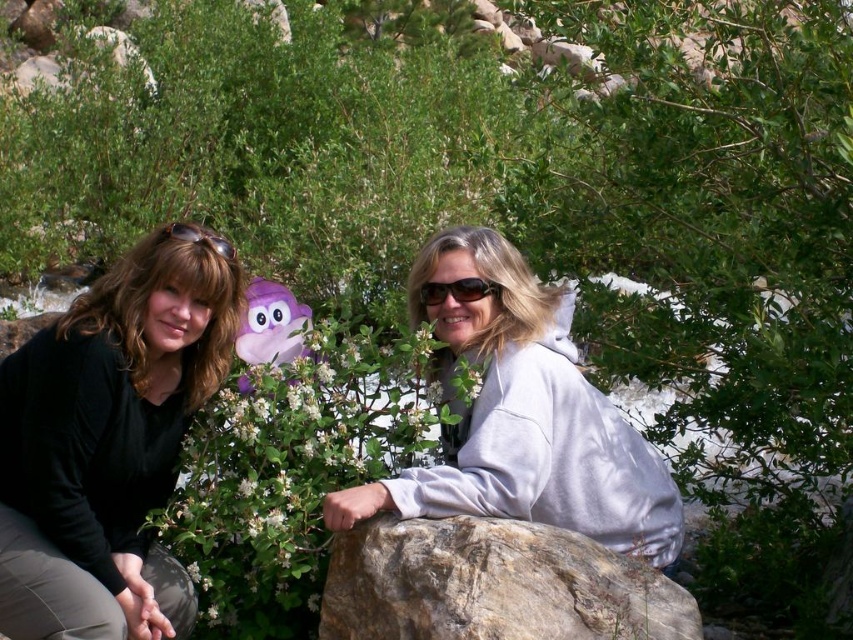
Question: Is white fleece jacket at center positioned behind rocky gray boulder at center?

Choices:
 (A) yes
 (B) no

Answer: (A)

Question: Considering the real-world distances, which object is farthest from the matte black sunglasses at upper left?

Choices:
 (A) rocky gray boulder at center
 (B) black matte shirt at lower left

Answer: (A)

Question: Is black matte shirt at lower left positioned at the back of white fleece jacket at center?

Choices:
 (A) yes
 (B) no

Answer: (B)

Question: Is black matte shirt at lower left closer to the viewer compared to matte black sunglasses at upper left?

Choices:
 (A) yes
 (B) no

Answer: (A)

Question: Which point appears closest to the camera in this image?

Choices:
 (A) 181,228
 (B) 193,266
 (C) 529,598
 (D) 442,298

Answer: (C)

Question: Which of these objects is positioned farthest from the matte black sunglasses at upper left?

Choices:
 (A) black matte shirt at lower left
 (B) rocky gray boulder at center
 (C) white fleece jacket at center

Answer: (B)